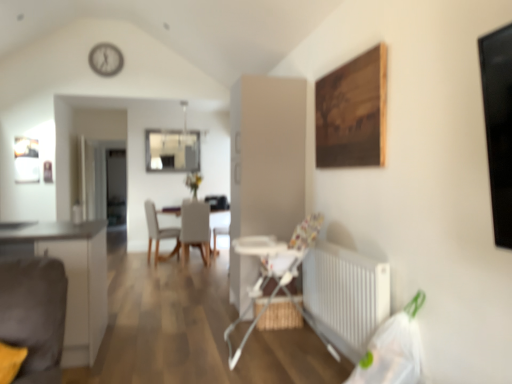
What do you see at coordinates (106, 59) in the screenshot? Image resolution: width=512 pixels, height=384 pixels. I see `white plastic clock at upper center` at bounding box center [106, 59].

Identify the location of matte gray chair at center, which ranks as the first chair in right-to-left order. The image size is (512, 384). (195, 229).

I want to click on matte white cabinet at left, so click(71, 278).

In order to face matte white cabinet at left, should I rotate leftwards or rightwards?

A 27.181 degree turn to the left will do.

The height and width of the screenshot is (384, 512). What do you see at coordinates (274, 268) in the screenshot?
I see `white plastic high chair at center` at bounding box center [274, 268].

In order to face white plastic high chair at center, should I rotate leftwards or rightwards?

To align with it, rotate right about 1.920°.

What is the approximate width of white metallic radiator at lower right?

The width of white metallic radiator at lower right is 5.39 inches.

The image size is (512, 384). Describe the element at coordinates (345, 295) in the screenshot. I see `white metallic radiator at lower right` at that location.

From the picture: Measure the distance between wooden painting at upper right and camera.

wooden painting at upper right is 2.42 meters away from camera.

Locate an element on the screen. The image size is (512, 384). white fabric chair at center, arranged as the 1th chair when viewed from the left is located at coordinates (159, 234).

Find the location of a particular element. white plastic clock at upper center is located at coordinates (106, 59).

Which is closer, (194, 204) or (105, 70)?

Clearly, point (194, 204) is more distant from the camera than point (105, 70).

Is matte gray chair at center, which ranks as the first chair in right-to-left order, wider than white plastic clock at upper center?

Yes, matte gray chair at center, which ranks as the first chair in right-to-left order, is wider than white plastic clock at upper center.

Is matte gray chair at center, placed as the second chair when sorted from left to right, smaller than white plastic clock at upper center?

No, matte gray chair at center, placed as the second chair when sorted from left to right, is not smaller than white plastic clock at upper center.

Is matte gray chair at center, placed as the second chair when sorted from left to right, taller or shorter than white plastic clock at upper center?

In the image, matte gray chair at center, placed as the second chair when sorted from left to right, appears to be taller than white plastic clock at upper center.

Is white metallic radiator at lower right behind wooden painting at upper right?

No, the depth of white metallic radiator at lower right is less than that of wooden painting at upper right.

Consider the image. Is white metallic radiator at lower right wider than wooden painting at upper right?

Yes.

Between white metallic radiator at lower right and wooden painting at upper right, which one has larger size?

white metallic radiator at lower right is bigger.

Does transparent glass window at center come in front of wooden painting at upper right?

That is False.

Considering the sizes of objects transparent glass window at center and wooden painting at upper right in the image provided, who is bigger, transparent glass window at center or wooden painting at upper right?

wooden painting at upper right is bigger.

From a real-world perspective, is transparent glass window at center above or below wooden painting at upper right?

transparent glass window at center is above wooden painting at upper right.

Considering the sizes of objects transparent glass window at center and wooden painting at upper right in the image provided, who is taller, transparent glass window at center or wooden painting at upper right?

transparent glass window at center is taller.

From the image's perspective, which one is positioned lower, wooden painting at upper right or transparent glass window at center?

From the image's view, wooden painting at upper right is below.

Can you tell me how much wooden painting at upper right and transparent glass window at center differ in facing direction?

The angular difference between wooden painting at upper right and transparent glass window at center is 90.9 degrees.

Can you confirm if wooden painting at upper right is smaller than transparent glass window at center?

No, wooden painting at upper right is not smaller than transparent glass window at center.

Is point (329, 143) closer to viewer compared to point (147, 130)?

Yes, point (329, 143) is closer to viewer.

Is transparent glass window at center bigger or smaller than white metallic radiator at lower right?

Considering their sizes, transparent glass window at center takes up less space than white metallic radiator at lower right.

Considering the sizes of objects transparent glass window at center and white metallic radiator at lower right in the image provided, who is taller, transparent glass window at center or white metallic radiator at lower right?

transparent glass window at center.

Relative to white metallic radiator at lower right, is transparent glass window at center in front or behind?

In the image, transparent glass window at center appears behind white metallic radiator at lower right.

The height and width of the screenshot is (384, 512). I want to click on armchair below the white plastic clock at upper center (from the image's perspective), so click(x=274, y=268).

Would you consider white plastic high chair at center to be distant from white plastic clock at upper center?

Yes, white plastic high chair at center and white plastic clock at upper center are located far from each other.

From a real-world perspective, relative to white plastic clock at upper center, is white plastic high chair at center vertically above or below?

From a real-world perspective, white plastic high chair at center is physically below white plastic clock at upper center.

Is matte gray chair at center, which ranks as the first chair in right-to-left order, outside of transparent glass window at center?

matte gray chair at center, which ranks as the first chair in right-to-left order, lies outside transparent glass window at center's area.

Are matte gray chair at center, which ranks as the first chair in right-to-left order, and transparent glass window at center far apart?

matte gray chair at center, which ranks as the first chair in right-to-left order, is positioned a significant distance from transparent glass window at center.

Is matte gray chair at center, placed as the second chair when sorted from left to right, oriented towards transparent glass window at center?

No, matte gray chair at center, placed as the second chair when sorted from left to right, does not turn towards transparent glass window at center.

Would you say matte gray chair at center, placed as the second chair when sorted from left to right, is to the left or to the right of transparent glass window at center in the picture?

In the image, matte gray chair at center, placed as the second chair when sorted from left to right, appears on the right side of transparent glass window at center.

From the image's perspective, count 2nd chairs downward from the white plastic clock at upper center and point to it. Please provide its 2D coordinates.

[(195, 229)]

Where is `picture frame located above the white metallic radiator at lower right (from the image's perspective)`? This screenshot has width=512, height=384. picture frame located above the white metallic radiator at lower right (from the image's perspective) is located at coordinates (353, 112).

Which object lies nearer to the anchor point white fabric chair at center, arranged as the 1th chair when viewed from the left, white plastic clock at upper center or white plastic high chair at center?

Among the two, white plastic clock at upper center is located nearer to white fabric chair at center, arranged as the 1th chair when viewed from the left.

Based on their spatial positions, is white metallic radiator at lower right or white plastic high chair at center closer to matte white cabinet at left?

Among the two, white plastic high chair at center is located nearer to matte white cabinet at left.

Based on their spatial positions, is white fabric chair at center, the 2th chair in the right-to-left sequence, or matte white cabinet at left closer to matte gray chair at center, placed as the second chair when sorted from left to right?

white fabric chair at center, the 2th chair in the right-to-left sequence, is closer to matte gray chair at center, placed as the second chair when sorted from left to right.

Consider the image. When comparing their distances from matte gray chair at center, placed as the second chair when sorted from left to right, does white metallic radiator at lower right or white plastic clock at upper center seem closer?

Based on the image, white plastic clock at upper center appears to be nearer to matte gray chair at center, placed as the second chair when sorted from left to right.

Considering their positions, is white plastic high chair at center positioned closer to white plastic clock at upper center than white fabric chair at center, arranged as the 1th chair when viewed from the left?

The object closer to white plastic clock at upper center is white fabric chair at center, arranged as the 1th chair when viewed from the left.

Considering their positions, is white plastic high chair at center positioned closer to white plastic clock at upper center than matte gray chair at center, placed as the second chair when sorted from left to right?

The object closer to white plastic clock at upper center is matte gray chair at center, placed as the second chair when sorted from left to right.

Estimate the real-world distances between objects in this image. Which object is closer to transparent glass window at center, matte gray chair at center, which ranks as the first chair in right-to-left order, or white metallic radiator at lower right?

Based on the image, matte gray chair at center, which ranks as the first chair in right-to-left order, appears to be nearer to transparent glass window at center.

Based on their spatial positions, is white metallic radiator at lower right or white plastic high chair at center further from white plastic clock at upper center?

white metallic radiator at lower right lies further to white plastic clock at upper center than the other object.

The image size is (512, 384). I want to click on chair between white metallic radiator at lower right and white plastic clock at upper center along the z-axis, so click(195, 229).

Identify the location of armchair positioned between wooden painting at upper right and white plastic clock at upper center from near to far. (274, 268).

Where is `clock between matte white cabinet at left and transparent glass window at center along the z-axis`? clock between matte white cabinet at left and transparent glass window at center along the z-axis is located at coordinates (106, 59).

Find the location of `armchair between matte white cabinet at left and matte gray chair at center, which ranks as the first chair in right-to-left order, along the z-axis`. armchair between matte white cabinet at left and matte gray chair at center, which ranks as the first chair in right-to-left order, along the z-axis is located at coordinates (274, 268).